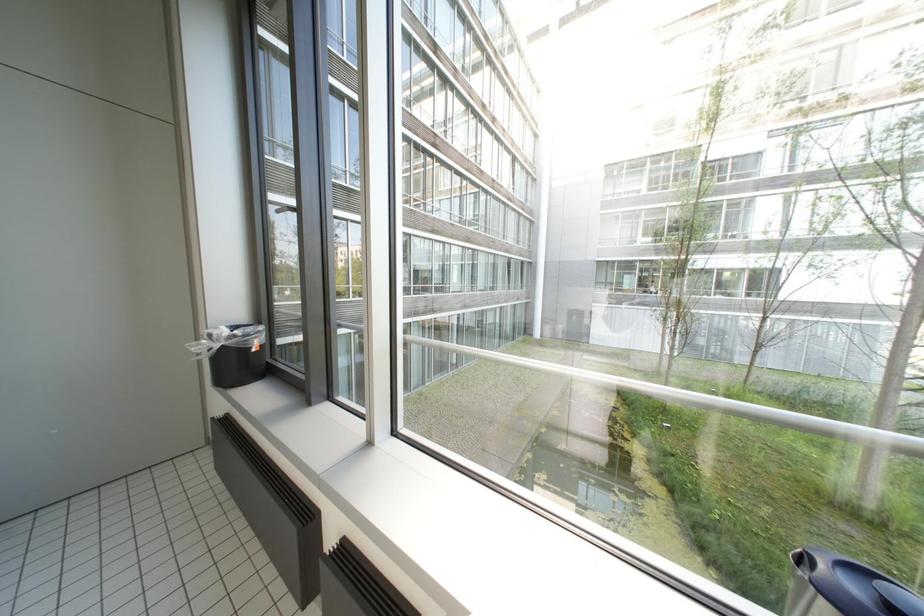
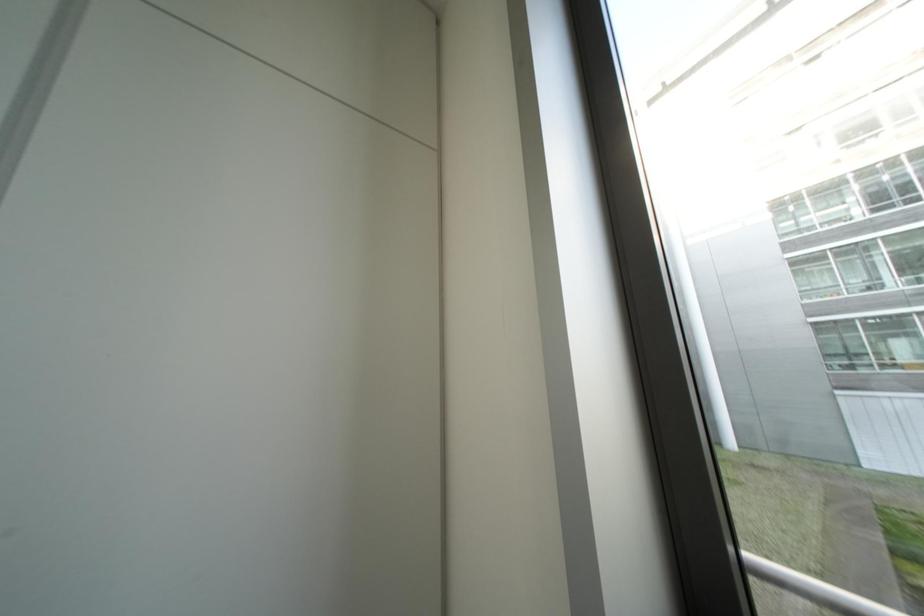
What movement of the cameraman would produce the second image?

The cameraman moved toward left, forward.